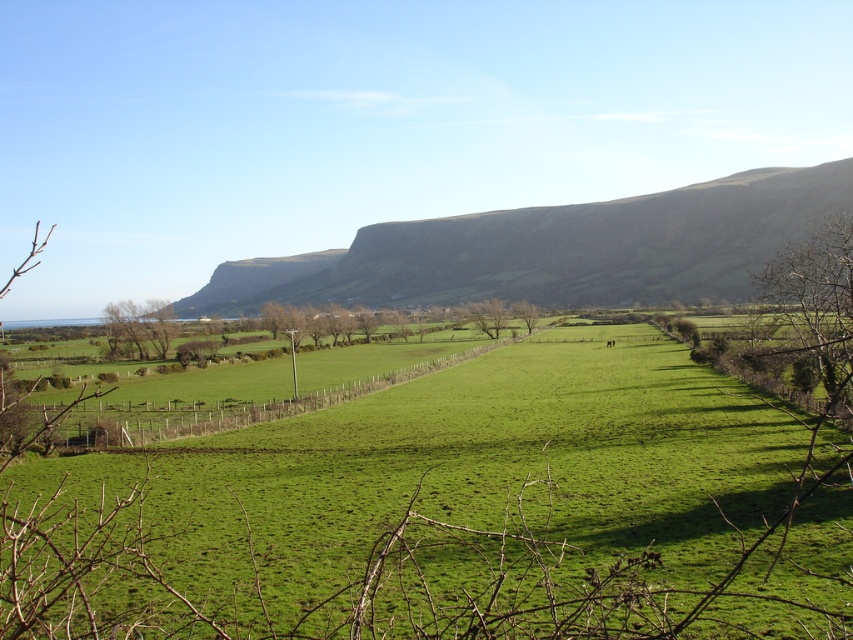
You are a hiker planning to cross the green grassy field at center and the dark brown rocky cliff at center. Which terrain would be easier to walk on?

The green grassy field at center is easier to walk on because it has a smaller size compared to the dark brown rocky cliff at center, making it less challenging terrain.

Based on the photo, you are standing at the point labeled point (527, 323) and want to walk towards the point labeled point (669, 428). According to the scene, will you be moving towards the foreground or the background?

Point (669, 428) is in front of point (527, 323), so moving towards it means you are walking towards the foreground.

You are a hiker standing at the edge of the green grassy field at center. You want to reach the dark brown rocky cliff at center to take a photo. Is the cliff behind or in front of the field?

The green grassy field at center is in front of the dark brown rocky cliff at center, so the cliff is behind the field.